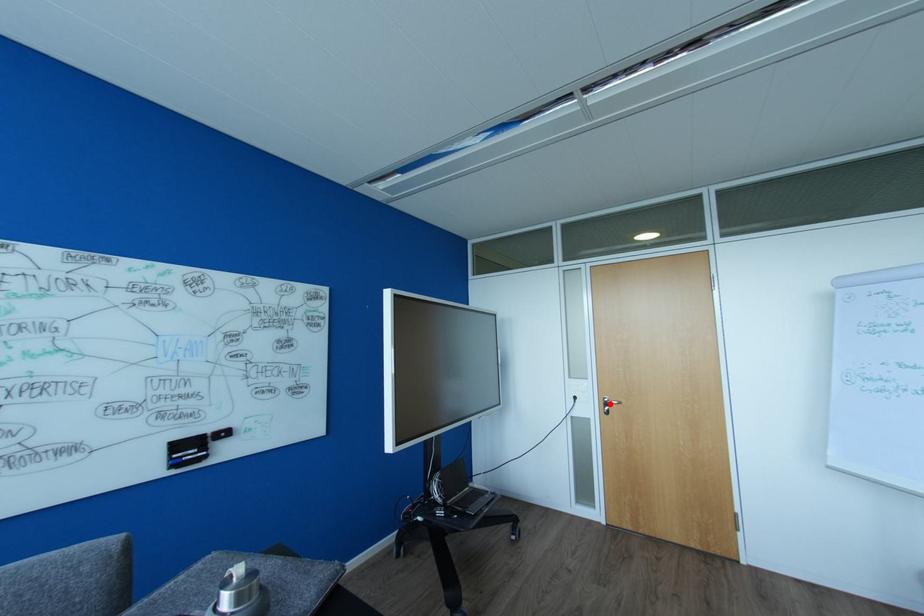
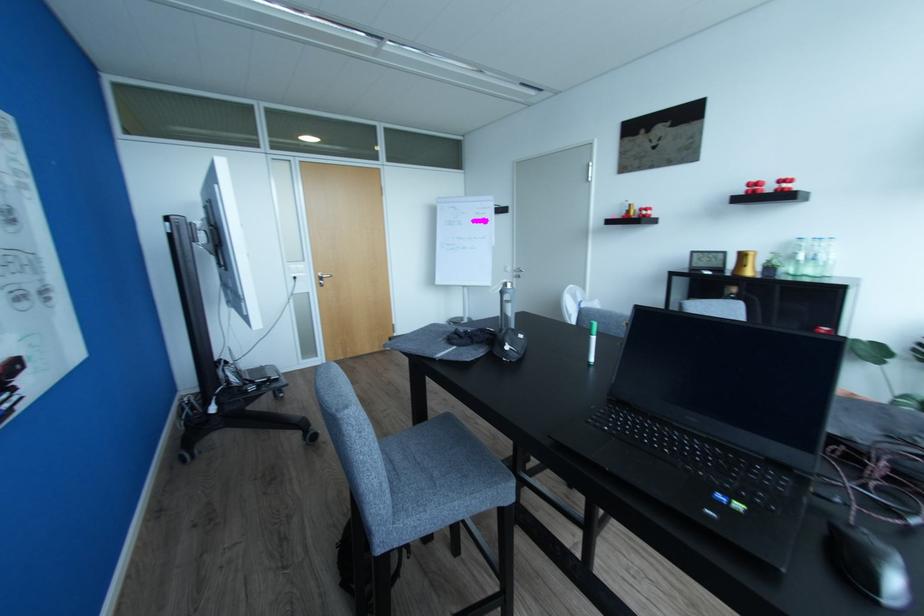
Question: I am providing you with two images of the same scene from different viewpoints. Given a red point in image1, look at the same physical point in image2. Is it:

Choices:
 (A) Closer to the viewpoint
 (B) Farther from the viewpoint

Answer: (A)